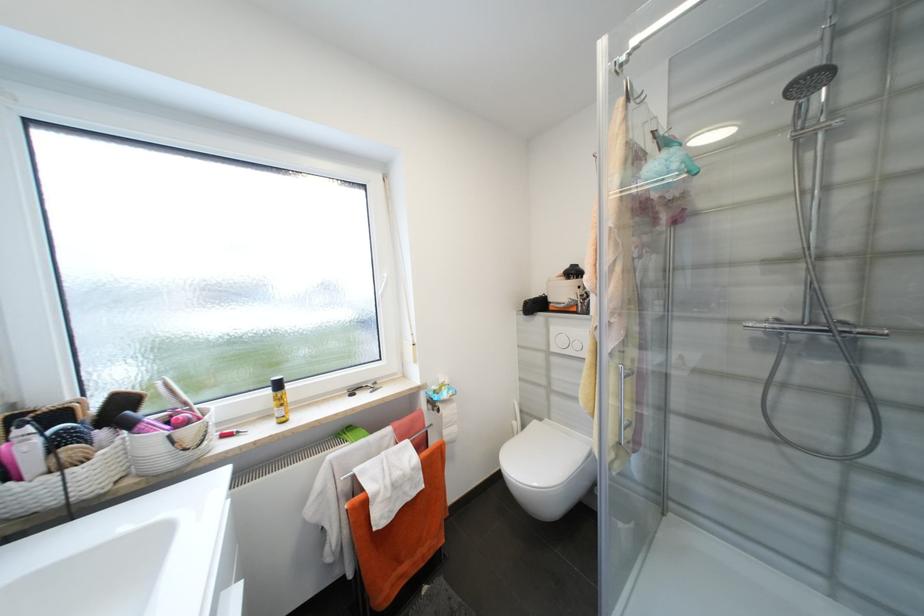
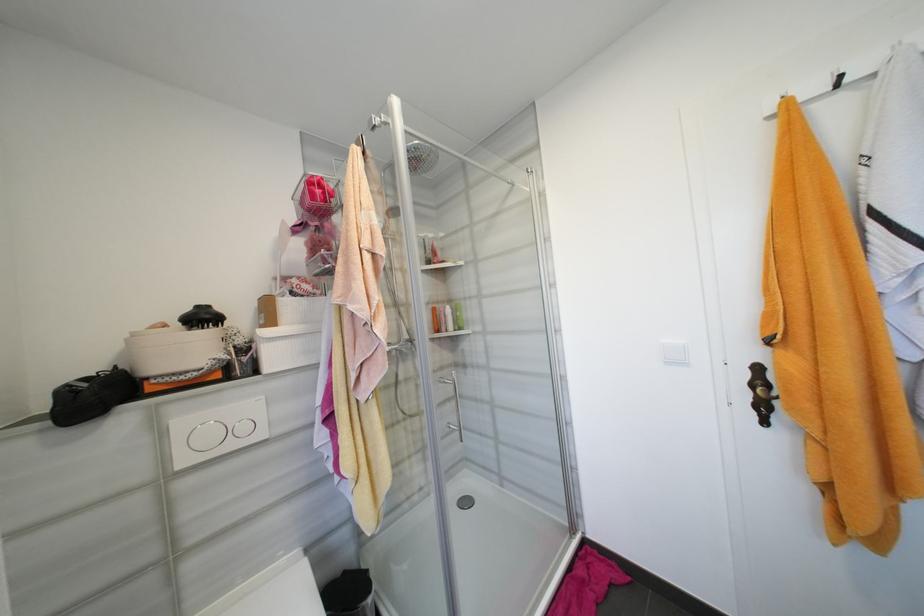
Question: The images are taken continuously from a first-person perspective. In which direction is your viewpoint rotating?

Choices:
 (A) Left
 (B) Right
 (C) Up
 (D) Down

Answer: (B)